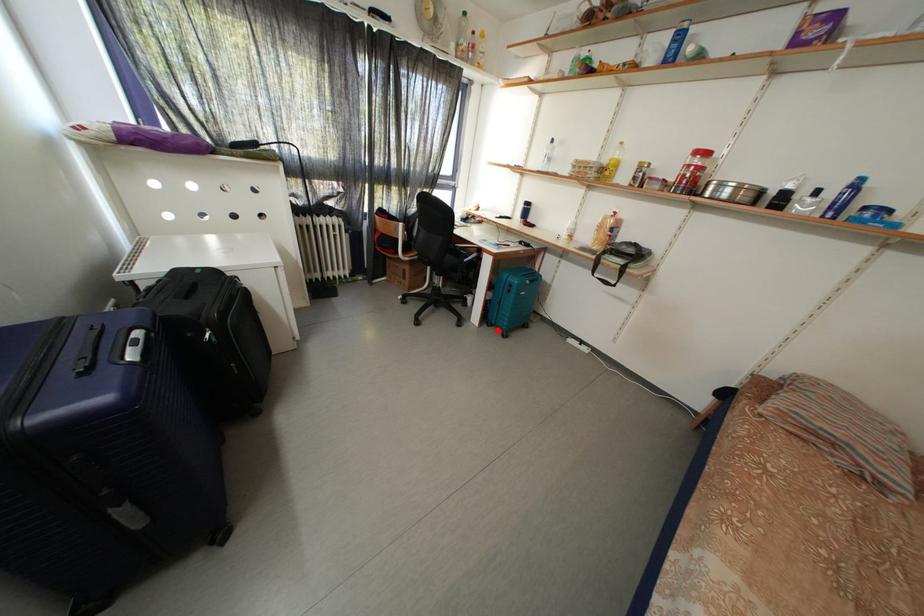
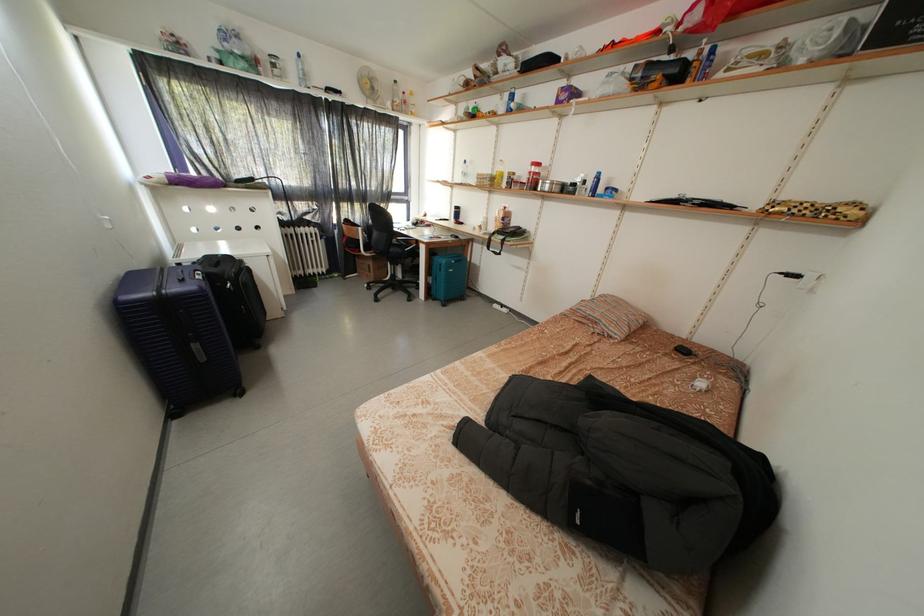
The point at the highlighted location is marked in the first image. Where is the corresponding point in the second image?

(442, 305)